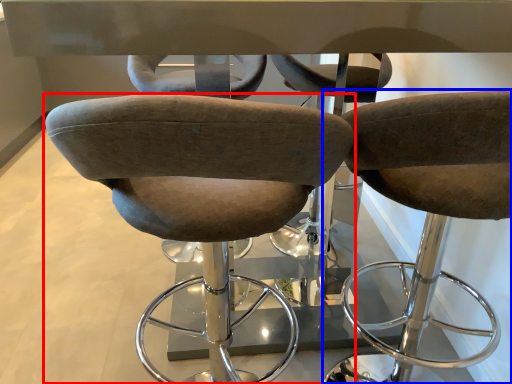
Question: Which object appears closest to the camera in this image, chair (highlighted by a red box) or chair (highlighted by a blue box)?

Choices:
 (A) chair
 (B) chair

Answer: (A)